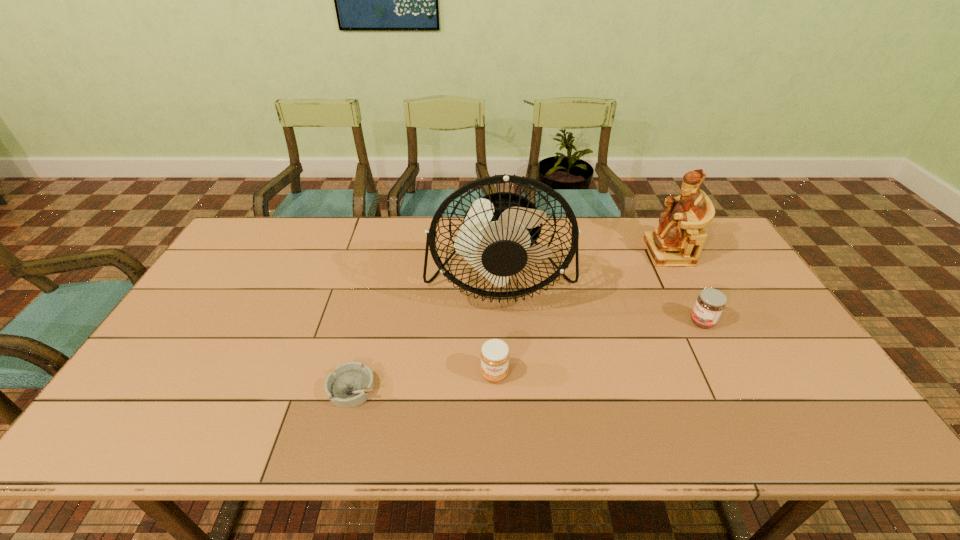
You are a GUI agent. You are given a task and a screenshot of the screen. Output one action in this format:
    pyautogui.click(x=<x>, y=<y>)
    Task: Click on the free space at the right edge of the desktop
    
    Given the screenshot: What is the action you would take?
    pyautogui.click(x=770, y=374)

Image resolution: width=960 pixels, height=540 pixels. In the image, there is a desktop. What are the coordinates of `free region at the far left corner` in the screenshot? It's located at (246, 249).

At what (x,y) coordinates should I click in order to perform the action: click on free space between the tallest object and the farther jam. Please return your answer as a coordinate pair (x, y). Looking at the image, I should click on (601, 300).

You are a GUI agent. You are given a task and a screenshot of the screen. Output one action in this format:
    pyautogui.click(x=<x>, y=<y>)
    Task: Click on the free space between the nearer jam and the tallest object
    The image size is (960, 540).
    Given the screenshot: What is the action you would take?
    pyautogui.click(x=497, y=326)

The image size is (960, 540). Find the location of `empty space that is in between the farther jam and the left jam`. empty space that is in between the farther jam and the left jam is located at coordinates (598, 348).

Locate an element on the screen. blank region between the right jam and the figurine is located at coordinates (685, 287).

In order to click on empty space between the left jam and the figurine in this screenshot , I will do `click(581, 313)`.

Locate an element on the screen. This screenshot has width=960, height=540. unoccupied position between the fan and the leftmost object is located at coordinates (426, 334).

Where is `free space between the figurine and the shortest object`? This screenshot has width=960, height=540. free space between the figurine and the shortest object is located at coordinates (511, 321).

Locate an element on the screen. Image resolution: width=960 pixels, height=540 pixels. free spot between the fan and the right jam is located at coordinates (601, 300).